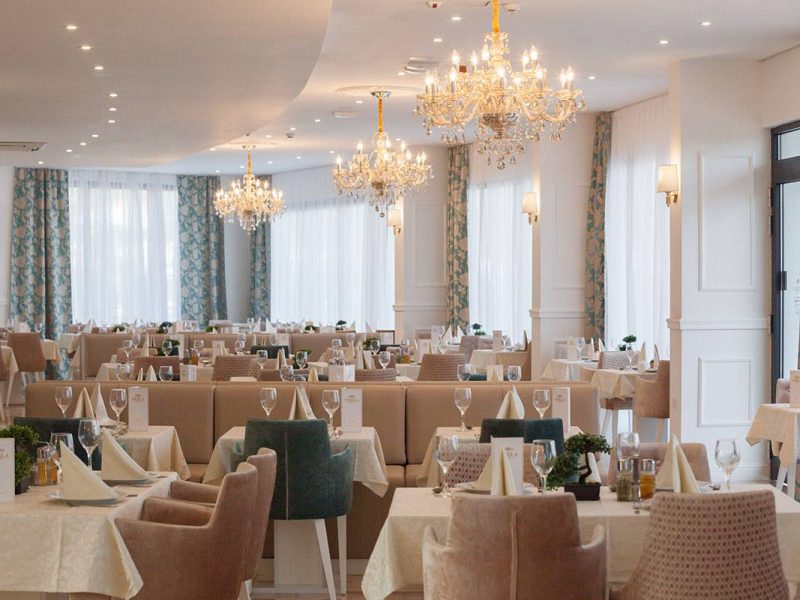
Identify the location of green chairs. (313, 471), (65, 430), (505, 422), (270, 347), (174, 343), (168, 324), (386, 346), (486, 372).